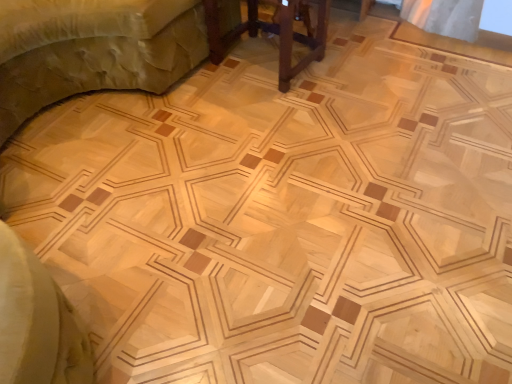
Describe the element at coordinates (272, 33) in the screenshot. This screenshot has width=512, height=384. I see `brown wooden table at center, which ranks as the first furniture in right-to-left order` at that location.

Find the location of a particular element. This screenshot has width=512, height=384. brown wooden table at center, which ranks as the first furniture in right-to-left order is located at coordinates (272, 33).

Describe the element at coordinates (98, 67) in the screenshot. I see `wooden bed at upper left, arranged as the 1th furniture when viewed from the left` at that location.

Identify the location of wooden bed at upper left, arranged as the 1th furniture when viewed from the left. (98, 67).

You are a GUI agent. You are given a task and a screenshot of the screen. Output one action in this format:
    pyautogui.click(x=<x>, y=<y>)
    Task: Click on the brown wooden table at center, the second furniture when ordered from left to right
    The height and width of the screenshot is (384, 512).
    Given the screenshot: What is the action you would take?
    pyautogui.click(x=272, y=33)

Which object is positioned more to the right, wooden bed at upper left, the second furniture positioned from the right, or brown wooden table at center, the second furniture when ordered from left to right?

Positioned to the right is brown wooden table at center, the second furniture when ordered from left to right.

Does wooden bed at upper left, the second furniture positioned from the right, lie in front of brown wooden table at center, the second furniture when ordered from left to right?

Yes, wooden bed at upper left, the second furniture positioned from the right, is in front of brown wooden table at center, the second furniture when ordered from left to right.

Which point is more forward, (184, 23) or (219, 27)?

The point (184, 23) is more forward.

In the scene shown: From the image's perspective, which object appears higher, wooden bed at upper left, the second furniture positioned from the right, or brown wooden table at center, which ranks as the first furniture in right-to-left order?

wooden bed at upper left, the second furniture positioned from the right, from the image's perspective.

From a real-world perspective, is wooden bed at upper left, the second furniture positioned from the right, above or below brown wooden table at center, which ranks as the first furniture in right-to-left order?

wooden bed at upper left, the second furniture positioned from the right, is situated higher than brown wooden table at center, which ranks as the first furniture in right-to-left order, in the real world.

Is wooden bed at upper left, arranged as the 1th furniture when viewed from the left, thinner than brown wooden table at center, the second furniture when ordered from left to right?

Incorrect, the width of wooden bed at upper left, arranged as the 1th furniture when viewed from the left, is not less than that of brown wooden table at center, the second furniture when ordered from left to right.

Between wooden bed at upper left, arranged as the 1th furniture when viewed from the left, and brown wooden table at center, the second furniture when ordered from left to right, which one has less height?

brown wooden table at center, the second furniture when ordered from left to right.

Can you confirm if wooden bed at upper left, arranged as the 1th furniture when viewed from the left, is bigger than brown wooden table at center, the second furniture when ordered from left to right?

Yes, wooden bed at upper left, arranged as the 1th furniture when viewed from the left, is bigger than brown wooden table at center, the second furniture when ordered from left to right.

In the scene shown: Is wooden bed at upper left, arranged as the 1th furniture when viewed from the left, not within brown wooden table at center, which ranks as the first furniture in right-to-left order?

Indeed, wooden bed at upper left, arranged as the 1th furniture when viewed from the left, is completely outside brown wooden table at center, which ranks as the first furniture in right-to-left order.

Are wooden bed at upper left, the second furniture positioned from the right, and brown wooden table at center, which ranks as the first furniture in right-to-left order, far apart?

wooden bed at upper left, the second furniture positioned from the right, is actually quite close to brown wooden table at center, which ranks as the first furniture in right-to-left order.

Is wooden bed at upper left, arranged as the 1th furniture when viewed from the left, turned away from brown wooden table at center, the second furniture when ordered from left to right?

No, brown wooden table at center, the second furniture when ordered from left to right, is not at the back of wooden bed at upper left, arranged as the 1th furniture when viewed from the left.

How far apart are wooden bed at upper left, arranged as the 1th furniture when viewed from the left, and brown wooden table at center, which ranks as the first furniture in right-to-left order?

They are 17.90 inches apart.

The height and width of the screenshot is (384, 512). In order to click on furniture in front of the brown wooden table at center, the second furniture when ordered from left to right in this screenshot , I will do `click(98, 67)`.

Is brown wooden table at center, which ranks as the first furniture in right-to-left order, at the left side of wooden bed at upper left, arranged as the 1th furniture when viewed from the left?

Incorrect, brown wooden table at center, which ranks as the first furniture in right-to-left order, is not on the left side of wooden bed at upper left, arranged as the 1th furniture when viewed from the left.

Consider the image. Considering their positions, is brown wooden table at center, which ranks as the first furniture in right-to-left order, located in front of or behind wooden bed at upper left, the second furniture positioned from the right?

In the image, brown wooden table at center, which ranks as the first furniture in right-to-left order, appears behind wooden bed at upper left, the second furniture positioned from the right.

Is point (322, 55) closer or farther from the camera than point (103, 57)?

Point (322, 55).

From the image's perspective, is brown wooden table at center, the second furniture when ordered from left to right, on top of wooden bed at upper left, arranged as the 1th furniture when viewed from the left?

No, from the image's perspective, brown wooden table at center, the second furniture when ordered from left to right, is not above wooden bed at upper left, arranged as the 1th furniture when viewed from the left.

From a real-world perspective, relative to wooden bed at upper left, arranged as the 1th furniture when viewed from the left, is brown wooden table at center, which ranks as the first furniture in right-to-left order, vertically above or below?

In terms of real-world spatial position, brown wooden table at center, which ranks as the first furniture in right-to-left order, is below wooden bed at upper left, arranged as the 1th furniture when viewed from the left.

Which of these two, brown wooden table at center, the second furniture when ordered from left to right, or wooden bed at upper left, the second furniture positioned from the right, is thinner?

With smaller width is brown wooden table at center, the second furniture when ordered from left to right.

Looking at this image, in terms of height, does brown wooden table at center, the second furniture when ordered from left to right, look taller or shorter compared to wooden bed at upper left, the second furniture positioned from the right?

brown wooden table at center, the second furniture when ordered from left to right, is shorter than wooden bed at upper left, the second furniture positioned from the right.

Can you confirm if brown wooden table at center, the second furniture when ordered from left to right, is bigger than wooden bed at upper left, arranged as the 1th furniture when viewed from the left?

No.

Does brown wooden table at center, which ranks as the first furniture in right-to-left order, contain wooden bed at upper left, the second furniture positioned from the right?

Actually, wooden bed at upper left, the second furniture positioned from the right, is outside brown wooden table at center, which ranks as the first furniture in right-to-left order.

Are brown wooden table at center, the second furniture when ordered from left to right, and wooden bed at upper left, arranged as the 1th furniture when viewed from the left, far apart?

They are positioned close to each other.

Is brown wooden table at center, which ranks as the first furniture in right-to-left order, facing towards wooden bed at upper left, the second furniture positioned from the right?

No.

Measure the distance from brown wooden table at center, the second furniture when ordered from left to right, to wooden bed at upper left, arranged as the 1th furniture when viewed from the left.

brown wooden table at center, the second furniture when ordered from left to right, is 17.90 inches away from wooden bed at upper left, arranged as the 1th furniture when viewed from the left.

You are a GUI agent. You are given a task and a screenshot of the screen. Output one action in this format:
    pyautogui.click(x=<x>, y=<y>)
    Task: Click on the furniture above the brown wooden table at center, the second furniture when ordered from left to right (from the image's perspective)
    
    Given the screenshot: What is the action you would take?
    pyautogui.click(x=98, y=67)

Find the location of `furniture in front of the brown wooden table at center, which ranks as the first furniture in right-to-left order`. furniture in front of the brown wooden table at center, which ranks as the first furniture in right-to-left order is located at coordinates (98, 67).

This screenshot has width=512, height=384. What are the coordinates of `furniture on the left of brown wooden table at center, the second furniture when ordered from left to right` in the screenshot? It's located at (98, 67).